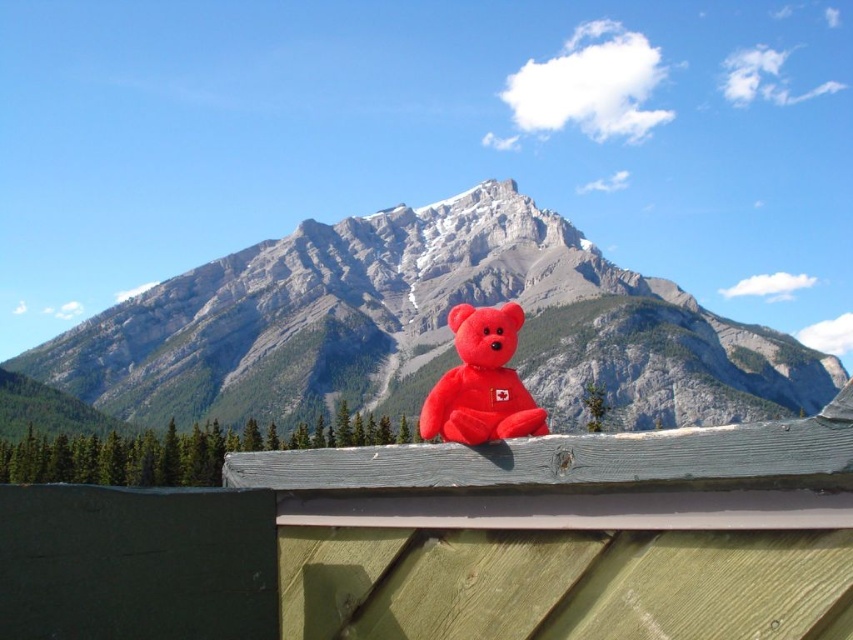
Can you confirm if matte red teddy bear at center is bigger than matte plush bear at center?

Indeed, matte red teddy bear at center has a larger size compared to matte plush bear at center.

Is point (726, 410) closer to camera compared to point (502, 355)?

No, (726, 410) is behind (502, 355).

At what (x,y) coordinates should I click in order to perform the action: click on matte red teddy bear at center. Please return your answer as a coordinate pair (x, y). The width and height of the screenshot is (853, 640). Looking at the image, I should click on (421, 326).

Is point (300, 605) behind point (424, 428)?

No, it is not.

This screenshot has height=640, width=853. In order to click on wooden at center in this screenshot , I will do `click(456, 541)`.

Can you confirm if wooden at center is positioned to the left of matte red teddy bear at center?

In fact, wooden at center is to the right of matte red teddy bear at center.

Is point (54, 548) behind point (289, 401)?

No.

Where is `wooden at center`? wooden at center is located at coordinates (456, 541).